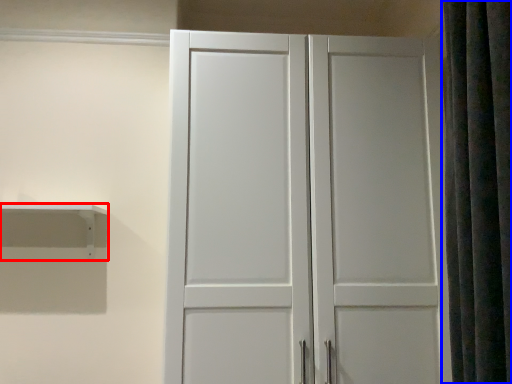
Question: Which object is further to the camera taking this photo, shelf (highlighted by a red box) or shower curtain (highlighted by a blue box)?

Choices:
 (A) shelf
 (B) shower curtain

Answer: (A)